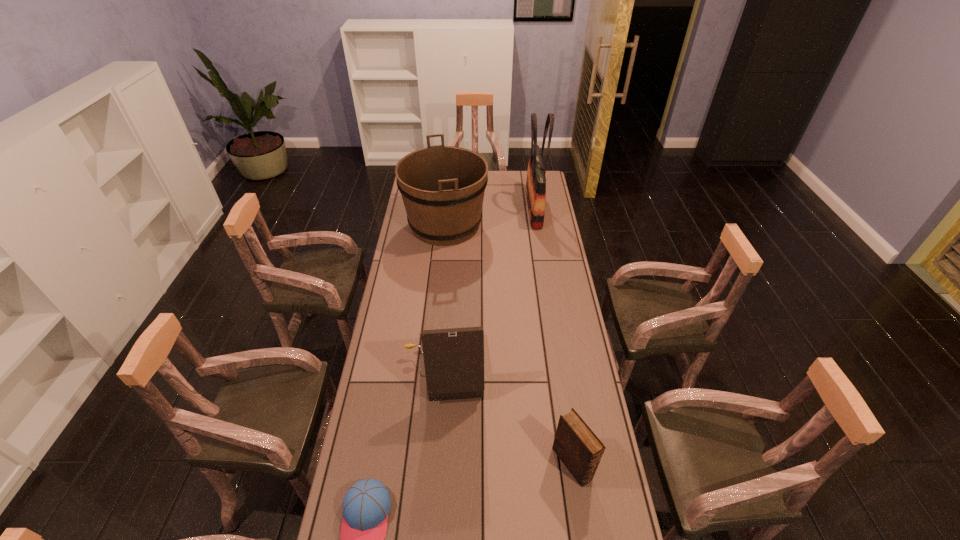
Find the location of a particular element. This screenshot has width=960, height=540. free space between the shopping bag and the fourth tallest object is located at coordinates (553, 336).

The image size is (960, 540). Identify the location of vacant region between the shopping bag and the Bible. (553, 336).

I want to click on vacant space in between the tallest object and the bucket, so click(490, 217).

Where is `empty location between the tallest object and the second tallest object`? empty location between the tallest object and the second tallest object is located at coordinates (490, 217).

This screenshot has width=960, height=540. I want to click on vacant area between the phonograph record and the tallest object, so click(x=489, y=289).

This screenshot has height=540, width=960. I want to click on object that is the third closest to the shopping bag, so click(x=580, y=450).

You are a GUI agent. You are given a task and a screenshot of the screen. Output one action in this format:
    pyautogui.click(x=<x>, y=<y>)
    Task: Click on the object that stands as the third closest to the shopping bag
    The image size is (960, 540).
    Given the screenshot: What is the action you would take?
    pyautogui.click(x=580, y=450)

Image resolution: width=960 pixels, height=540 pixels. What are the coordinates of `free location that satisfies the following two spatial constraints: 1. on the front side of the second shortest object; 2. on the right side of the phonograph record` in the screenshot? It's located at (438, 464).